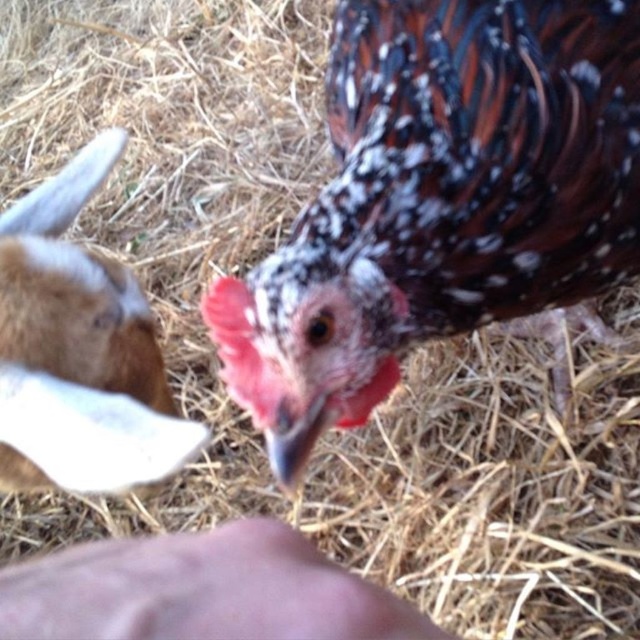
Question: Does speckled feathered chicken at center appear on the right side of brown woolen goat at left?

Choices:
 (A) no
 (B) yes

Answer: (B)

Question: Can you confirm if speckled feathered chicken at center is thinner than brown woolen goat at left?

Choices:
 (A) yes
 (B) no

Answer: (B)

Question: Which point is closer to the camera?

Choices:
 (A) speckled feathered chicken at center
 (B) brown woolen goat at left

Answer: (B)

Question: From the image, what is the correct spatial relationship of speckled feathered chicken at center in relation to brown woolen goat at left?

Choices:
 (A) above
 (B) below

Answer: (A)

Question: Which point is farther to the camera?

Choices:
 (A) (390, 291)
 (B) (116, 465)

Answer: (A)